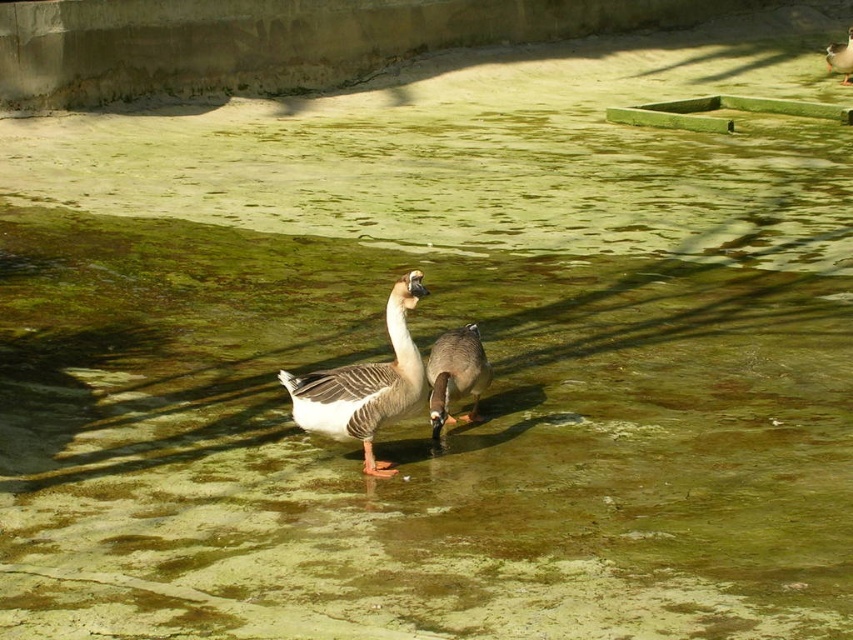
You are a photographer trying to capture both geese in a single shot. The geese are positioned at point (476, 396) and point (844, 74). Since you want to focus on the one closer to you, which goose should you aim your camera at?

You should aim your camera at the goose at point (476, 396) because it is closer to the viewer than the other goose at point (844, 74).

You are a wildlife photographer aiming to capture a photo of both the brown speckled duck at center and the brown matte duck at upper right. Since you want to ensure both are visible in the frame, which duck should you focus on first to account for their sizes?

The brown speckled duck at center is shorter than the brown matte duck at upper right, so you should focus on the brown speckled duck at center first to ensure it is fully visible in the frame.